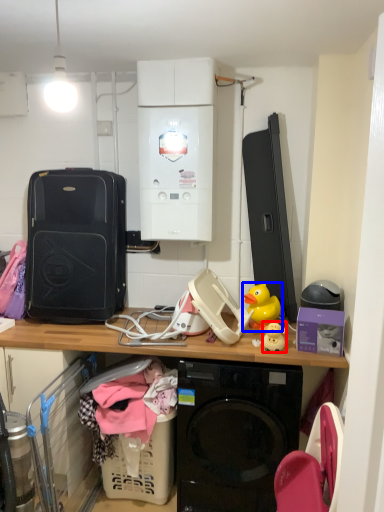
Question: Which object is closer to the camera taking this photo, toy (highlighted by a red box) or toy (highlighted by a blue box)?

Choices:
 (A) toy
 (B) toy

Answer: (A)